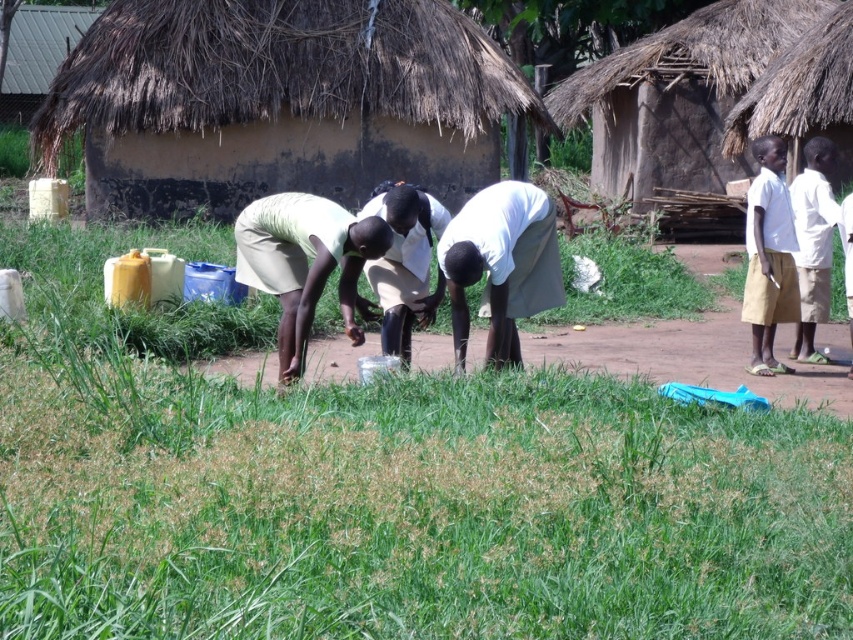
Question: Does thatched straw hut at upper right have a smaller size compared to white cotton shirt at center?

Choices:
 (A) yes
 (B) no

Answer: (A)

Question: Is green grass at center to the right of white cotton shirt at center from the viewer's perspective?

Choices:
 (A) no
 (B) yes

Answer: (A)

Question: Among these objects, which one is farthest from the camera?

Choices:
 (A) white cotton shirt at center
 (B) white cotton shirt at upper right

Answer: (B)

Question: Is green grass at center to the right of thatched straw hut at upper right from the viewer's perspective?

Choices:
 (A) yes
 (B) no

Answer: (B)

Question: Which point is closer to the camera?

Choices:
 (A) (482, 230)
 (B) (399, 410)
 (C) (454, 164)

Answer: (B)

Question: Which object is positioned farthest from the white cotton shirt at center?

Choices:
 (A) green grass at center
 (B) thatched straw hut at upper right
 (C) thatched straw hut at upper center
 (D) white cotton shirt at upper right

Answer: (B)